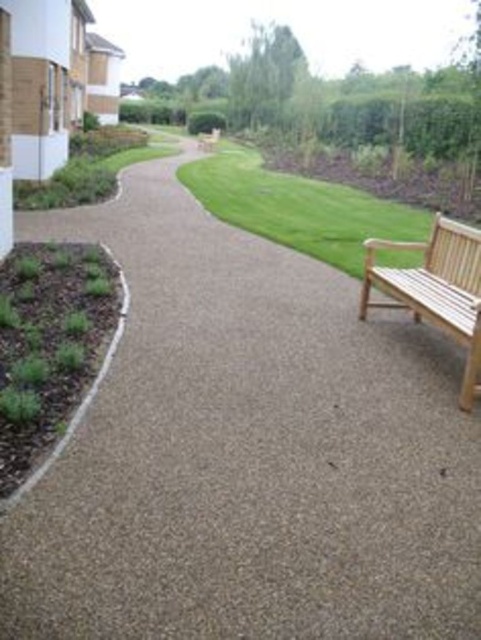
What do you see at coordinates (298, 208) in the screenshot? This screenshot has width=481, height=640. I see `green grass at center` at bounding box center [298, 208].

Is green grass at center positioned before light brown wooden bench at right?

That is False.

Is point (218, 176) in front of point (458, 339)?

No, (218, 176) is further to viewer.

At what (x,y) coordinates should I click in order to perform the action: click on green grass at center. Please return your answer as a coordinate pair (x, y). Looking at the image, I should click on (298, 208).

Is dark brown mulch at lower left closer to camera compared to light brown wooden bench at right?

Yes.

Does point (93, 330) come closer to viewer compared to point (383, 280)?

Yes, it is in front of point (383, 280).

Find the location of a particular element. Image resolution: width=481 pixels, height=640 pixels. dark brown mulch at lower left is located at coordinates (51, 349).

The width and height of the screenshot is (481, 640). I want to click on dark brown mulch at lower left, so click(x=51, y=349).

Which is in front, point (47, 339) or point (225, 172)?

Point (47, 339)

This screenshot has height=640, width=481. I want to click on dark brown mulch at lower left, so click(51, 349).

You are a GUI agent. You are given a task and a screenshot of the screen. Output one action in this format:
    pyautogui.click(x=<x>, y=<y>)
    Task: Click on the dark brown mulch at lower left
    Image resolution: width=481 pixels, height=640 pixels.
    Given the screenshot: What is the action you would take?
    pyautogui.click(x=51, y=349)